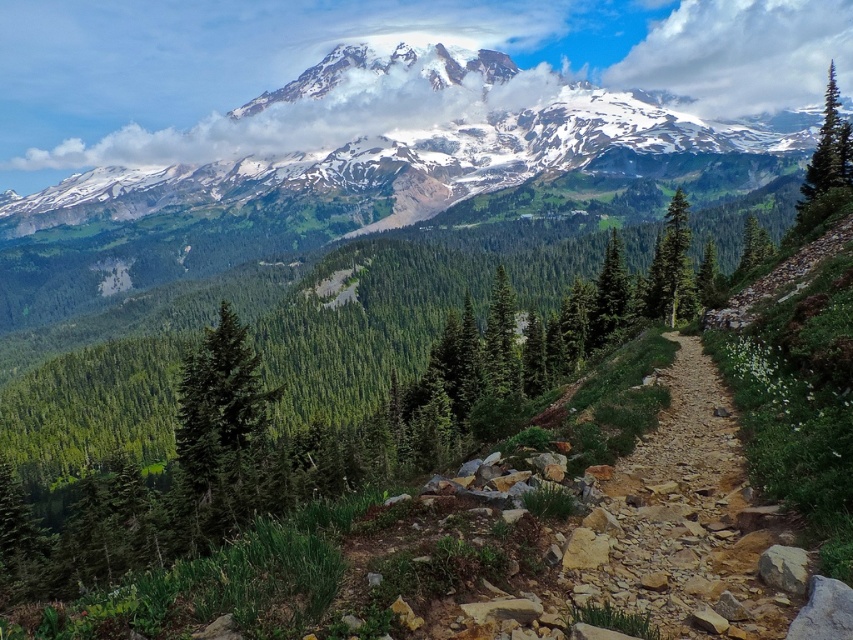
Question: Which point is farther from the camera taking this photo?

Choices:
 (A) (683, 225)
 (B) (552, 136)

Answer: (B)

Question: Is snowy granite mountain range at upper center positioned in front of green textured tree at right?

Choices:
 (A) no
 (B) yes

Answer: (A)

Question: Which of the following is the farthest from the observer?

Choices:
 (A) green matte tree at center-left
 (B) green textured tree at center

Answer: (B)

Question: Which point appears farthest from the camera in this image?

Choices:
 (A) (509, 323)
 (B) (680, 198)

Answer: (A)

Question: Can you confirm if snowy granite mountain range at upper center is positioned above green textured pine tree at upper right?

Choices:
 (A) yes
 (B) no

Answer: (A)

Question: Does green matte tree at center-left have a greater width compared to green textured pine tree at upper right?

Choices:
 (A) no
 (B) yes

Answer: (A)